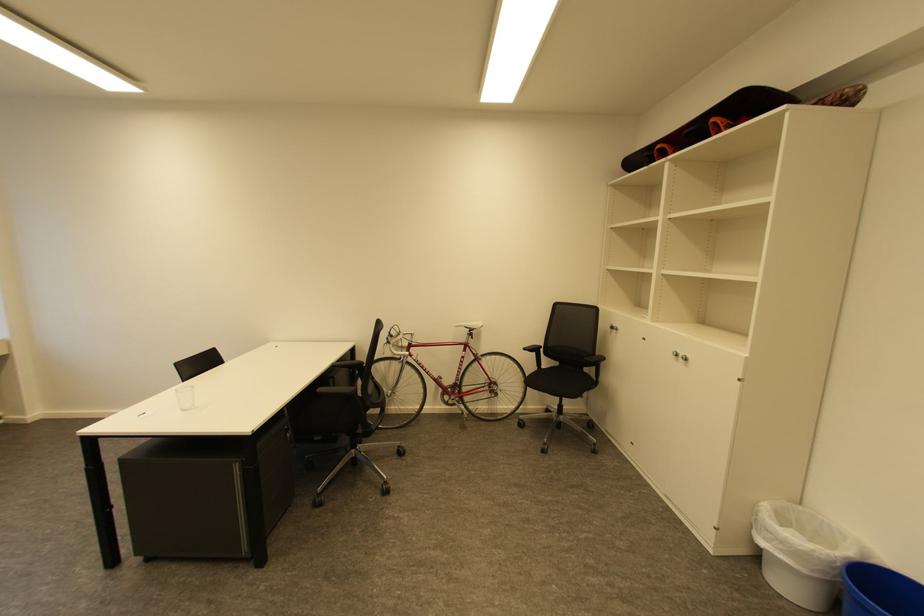
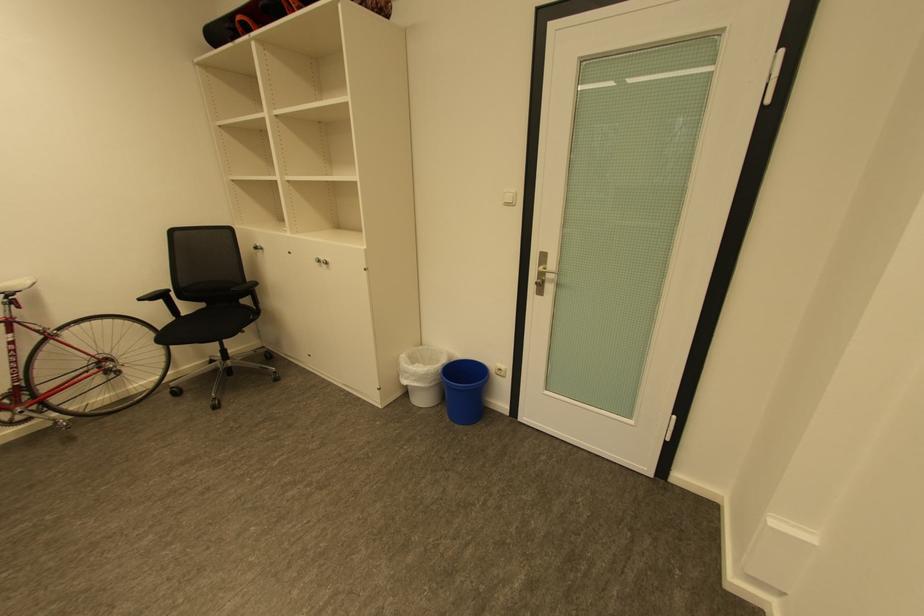
The point at (775, 533) is marked in the first image. Where is the corresponding point in the second image?

(414, 373)